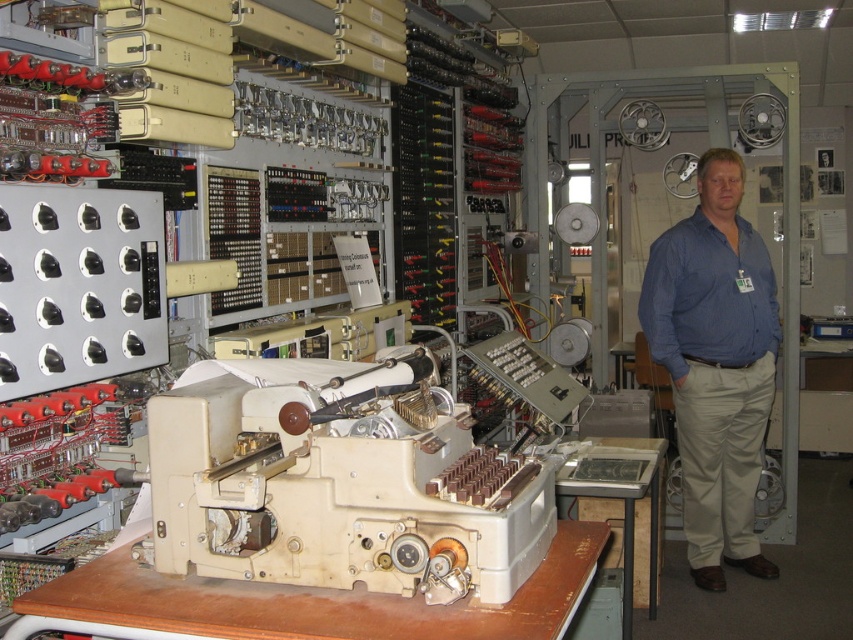
You are a museum guide explaining the historical computing equipment to visitors. You notice two blue shirts in the scene. The first is labeled as the blue shirt at center, and the second is the blue cotton shirt at right. Which of these two shirts is positioned further to the right?

The blue cotton shirt at right is positioned further to the right because the blue shirt at center is to the right of it, meaning the blue cotton shirt at right is actually located more to the left.

You are a visitor at this vintage computing exhibit and want to take a photo of both the blue shirt at center and the beige wood workbench at center. Since you want both to be fully visible in the frame, will you need to zoom out your camera to include both?

The blue shirt at center has a lesser width compared to beige wood workbench at center. Therefore, to capture both in the frame without cropping either, you should zoom out your camera to accommodate the wider beige wood workbench at center.